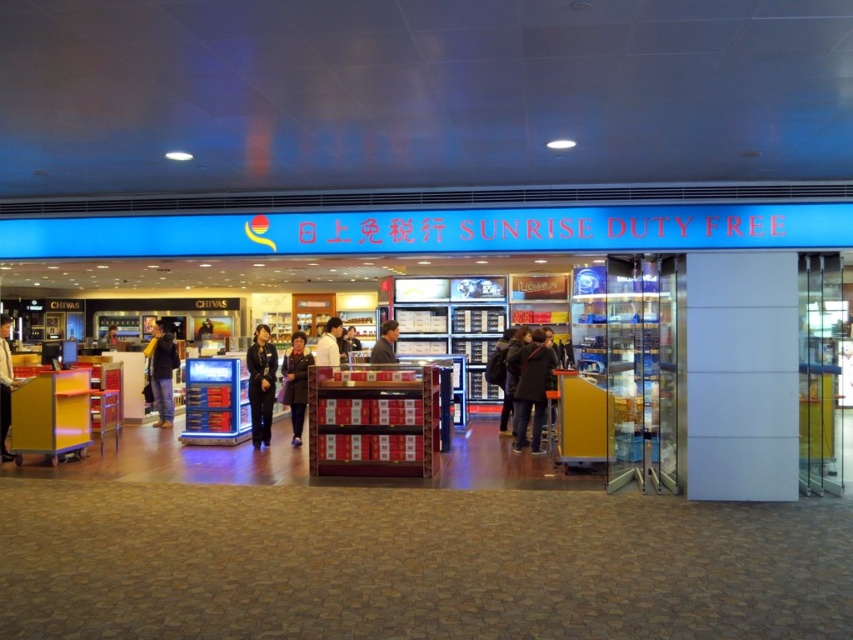
Question: Among these objects, which one is farthest from the camera?

Choices:
 (A) dark blue uniform at center
 (B) dark gray suit at left
 (C) blue glossy signboard at center

Answer: (A)

Question: In this image, where is dark gray fabric coat at center located relative to gray fabric jacket at center?

Choices:
 (A) left
 (B) right

Answer: (A)

Question: Which of the following is the closest to the observer?

Choices:
 (A) dark gray fabric coat at center
 (B) gray fabric jacket at center
 (C) dark blue uniform at center
 (D) white shirt at center

Answer: (D)

Question: Is dark gray coat at center behind gray fabric jacket at center?

Choices:
 (A) no
 (B) yes

Answer: (B)

Question: Which of the following is the farthest from the observer?

Choices:
 (A) (379, 352)
 (B) (541, 406)

Answer: (B)

Question: Can you confirm if dark gray fabric coat at center is wider than dark gray suit at left?

Choices:
 (A) yes
 (B) no

Answer: (B)